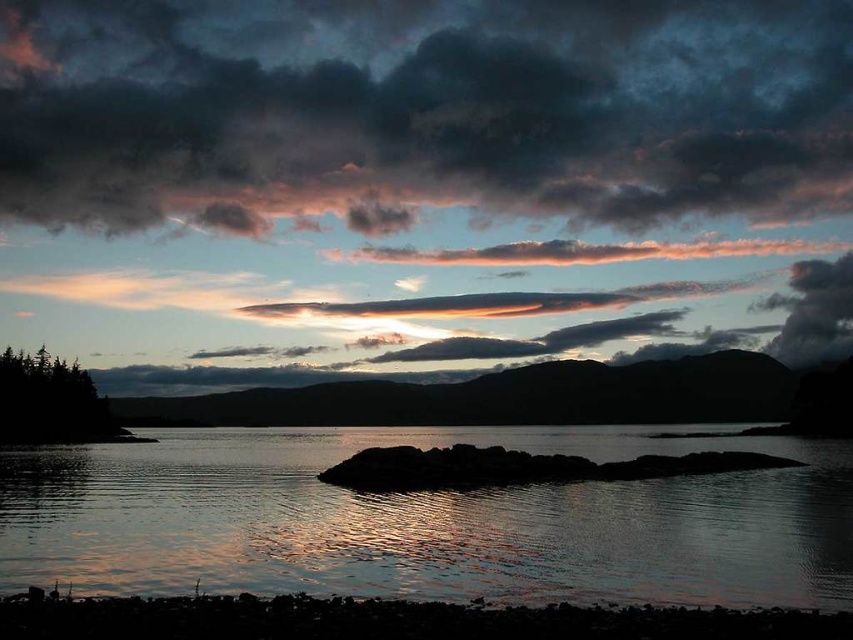
Question: Estimate the real-world distances between objects in this image. Which object is closer to the dark gray cloud at upper center?

Choices:
 (A) silvery reflective water at center
 (B) smooth sand shoreline at lower center
 (C) translucent pink cloud at center

Answer: (C)

Question: Does silvery reflective water at center come behind smooth sand shoreline at lower center?

Choices:
 (A) no
 (B) yes

Answer: (B)

Question: Estimate the real-world distances between objects in this image. Which object is farther from the dark gray cloud at upper center?

Choices:
 (A) silvery reflective water at center
 (B) smooth sand shoreline at lower center

Answer: (B)

Question: Considering the real-world distances, which object is farthest from the smooth sand shoreline at lower center?

Choices:
 (A) translucent pink cloud at center
 (B) dark gray cloud at upper center

Answer: (B)

Question: Observing the image, what is the correct spatial positioning of silvery reflective water at center in reference to smooth sand shoreline at lower center?

Choices:
 (A) left
 (B) right

Answer: (A)

Question: Is dark gray cloud at upper center to the right of translucent pink cloud at center from the viewer's perspective?

Choices:
 (A) no
 (B) yes

Answer: (A)